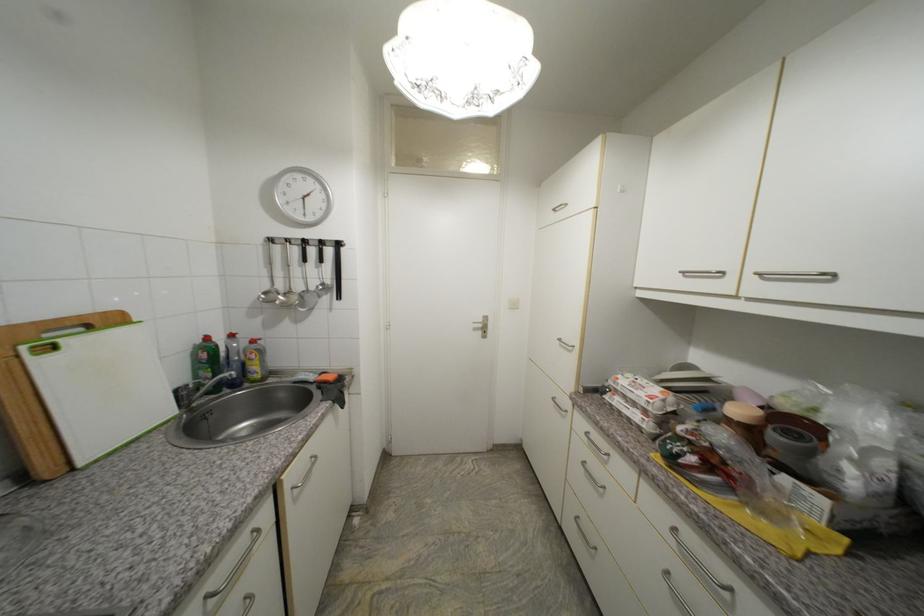
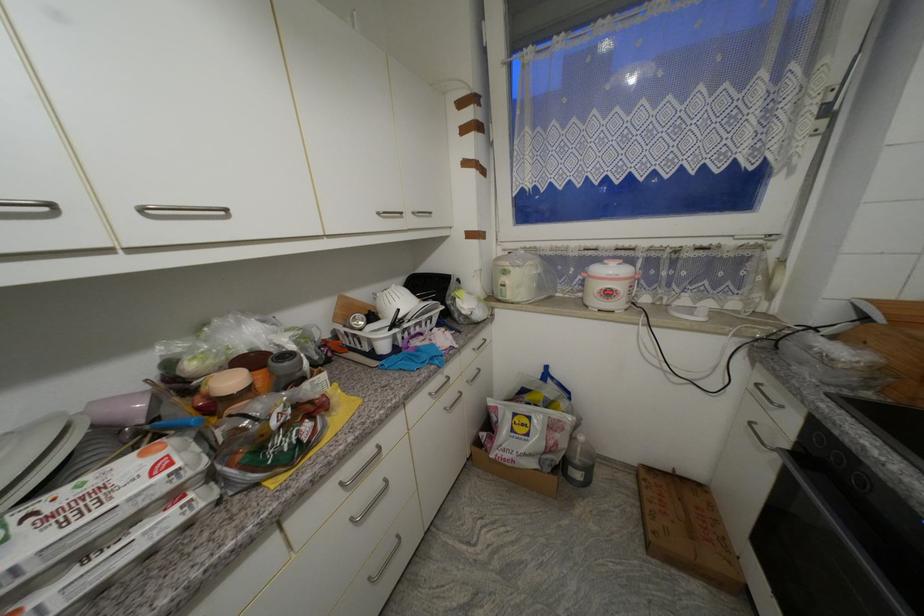
Where in the second image is the point corresponding to (789,440) from the first image?

(292, 365)